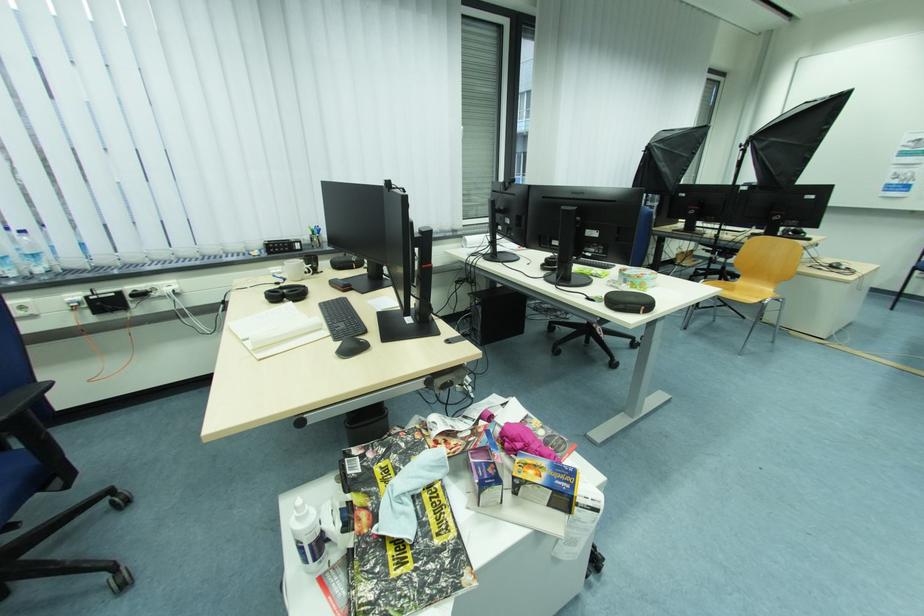
What do you see at coordinates (27, 400) in the screenshot? I see `a blue chair armrest` at bounding box center [27, 400].